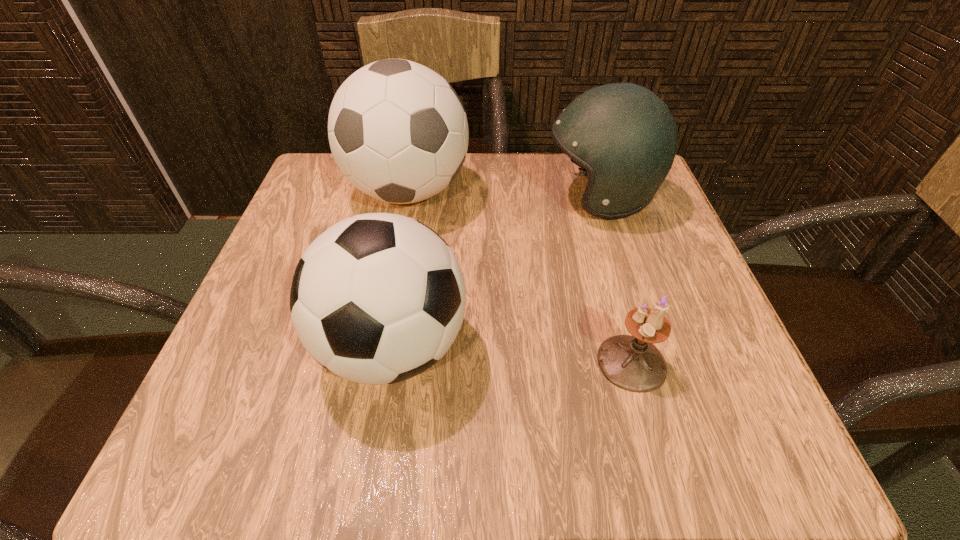
The height and width of the screenshot is (540, 960). I want to click on vacant space that's between the farther soccer ball and the shortest object, so click(x=519, y=277).

I want to click on vacant space in between the shortest object and the shorter soccer ball, so click(513, 355).

The image size is (960, 540). Identify the location of object that can be found as the third closest to the farther soccer ball. (633, 363).

Locate an element on the screen. object that stands as the second closest to the shorter soccer ball is located at coordinates (633, 363).

You are a GUI agent. You are given a task and a screenshot of the screen. Output one action in this format:
    pyautogui.click(x=<x>, y=<y>)
    Task: Click on the vacant space that satisfies the following two spatial constraints: 1. on the front side of the candle holder; 2. on the right side of the nearer soccer ball
    Image resolution: width=960 pixels, height=540 pixels.
    Given the screenshot: What is the action you would take?
    pyautogui.click(x=391, y=362)

What are the coordinates of `free spot that satisfies the following two spatial constraints: 1. on the front side of the farther soccer ball; 2. on the right side of the candle holder` in the screenshot? It's located at (374, 362).

Image resolution: width=960 pixels, height=540 pixels. Find the location of `vacant space that satisfies the following two spatial constraints: 1. at the face opening of the football helmet; 2. on the front side of the candle holder`. vacant space that satisfies the following two spatial constraints: 1. at the face opening of the football helmet; 2. on the front side of the candle holder is located at coordinates (653, 362).